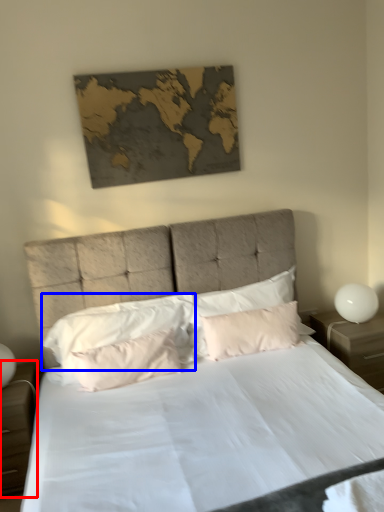
Question: Which object is further to the camera taking this photo, nightstand (highlighted by a red box) or pillow (highlighted by a blue box)?

Choices:
 (A) nightstand
 (B) pillow

Answer: (B)